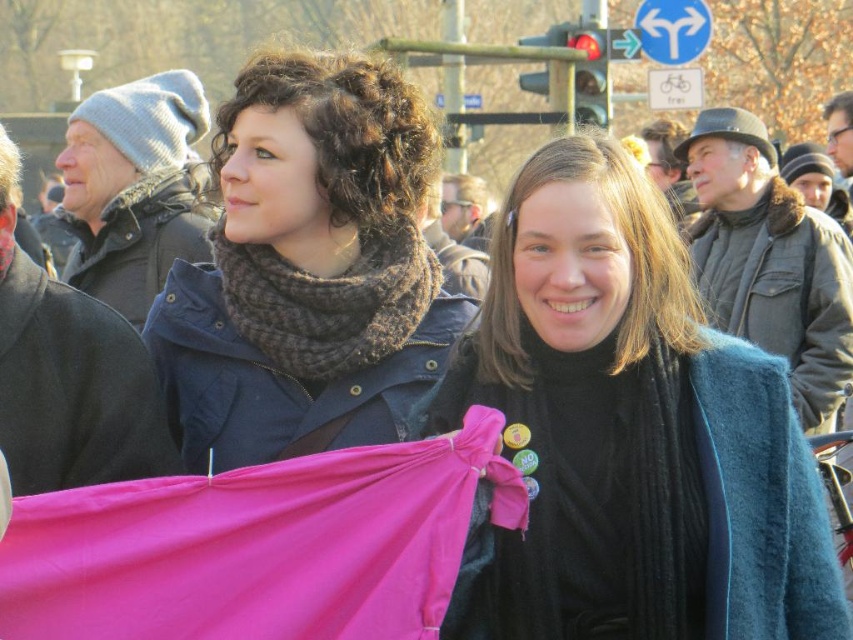
Is velvet teal coat at center wider than knitted wool scarf at center?

No, velvet teal coat at center is not wider than knitted wool scarf at center.

Between velvet teal coat at center and knitted wool scarf at center, which one appears on the right side from the viewer's perspective?

velvet teal coat at center is more to the right.

Is point (755, 560) positioned before point (393, 212)?

Yes.

In order to click on velvet teal coat at center in this screenshot , I will do point(631,432).

Does velvet teal coat at center have a smaller size compared to brown knitted scarf at center?

Correct, velvet teal coat at center occupies less space than brown knitted scarf at center.

Is point (631, 211) closer to camera compared to point (277, 276)?

That is True.

From the picture: Who is more distant from viewer, [540,324] or [241,252]?

Positioned behind is point [241,252].

The image size is (853, 640). In order to click on velvet teal coat at center in this screenshot , I will do `click(631, 432)`.

Can you confirm if knitted wool scarf at center is shorter than brown knitted scarf at center?

No.

Which is behind, point (368, 140) or point (352, 326)?

The point (352, 326) is more distant.

The height and width of the screenshot is (640, 853). What do you see at coordinates (306, 269) in the screenshot? I see `knitted wool scarf at center` at bounding box center [306, 269].

Locate an element on the screen. knitted wool scarf at center is located at coordinates (306, 269).